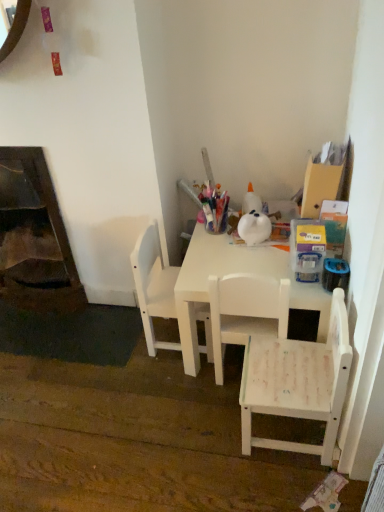
Locate an element on the screen. The image size is (384, 512). free location above white matte table at center (from a real-world perspective) is located at coordinates [x=241, y=248].